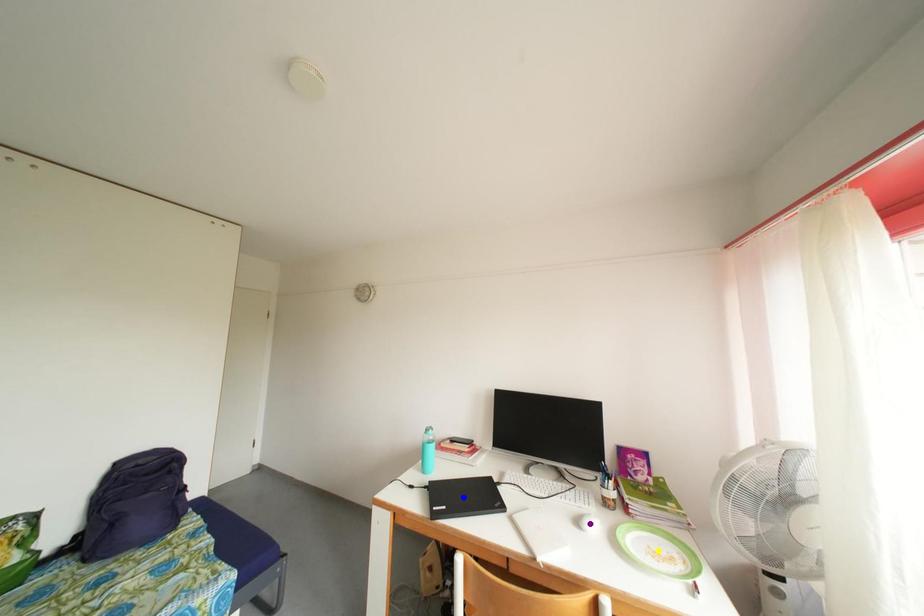
Order these from nearest to farthest:
- blue point
- purple point
- yellow point

yellow point, purple point, blue point